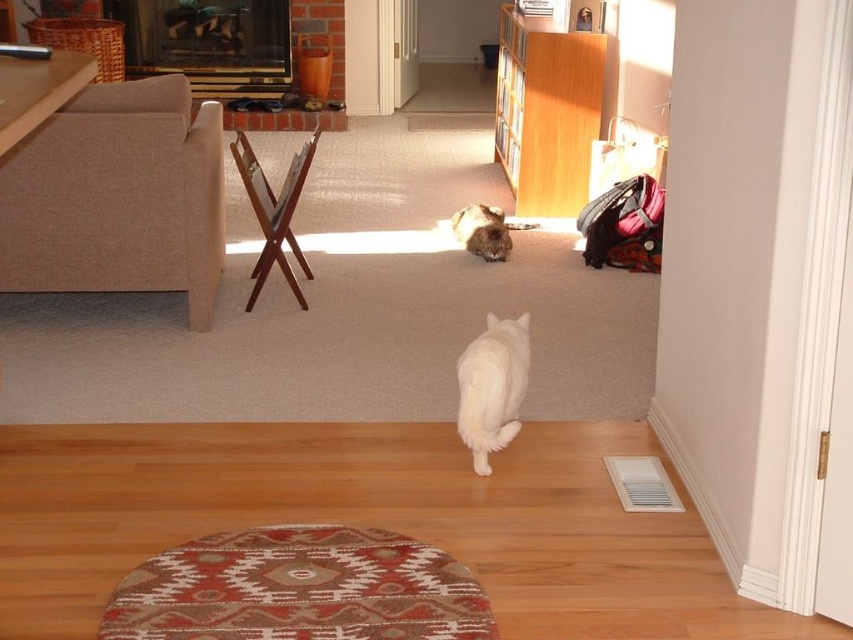
Does white fluffy cat at center come in front of fuzzy brown cat at center?

Yes, it is.

Looking at this image, can you confirm if white fluffy cat at center is shorter than fuzzy brown cat at center?

In fact, white fluffy cat at center may be taller than fuzzy brown cat at center.

What do you see at coordinates (492, 387) in the screenshot? Image resolution: width=853 pixels, height=640 pixels. I see `white fluffy cat at center` at bounding box center [492, 387].

The width and height of the screenshot is (853, 640). Find the location of `white fluffy cat at center`. white fluffy cat at center is located at coordinates coord(492,387).

Based on the photo, does wooden bookshelf at upper center have a greater width compared to fuzzy brown cat at center?

Correct, the width of wooden bookshelf at upper center exceeds that of fuzzy brown cat at center.

Is point (579, 104) farther from viewer compared to point (497, 208)?

No.

This screenshot has height=640, width=853. Find the location of `wooden bookshelf at upper center`. wooden bookshelf at upper center is located at coordinates click(x=546, y=112).

Can you confirm if wooden bookshelf at upper center is shorter than white fluffy cat at center?

No, wooden bookshelf at upper center is not shorter than white fluffy cat at center.

Is wooden bookshelf at upper center closer to camera compared to white fluffy cat at center?

No, it is not.

Is point (598, 124) closer to camera compared to point (495, 433)?

That is False.

Identify the location of wooden bookshelf at upper center. The image size is (853, 640). coord(546,112).